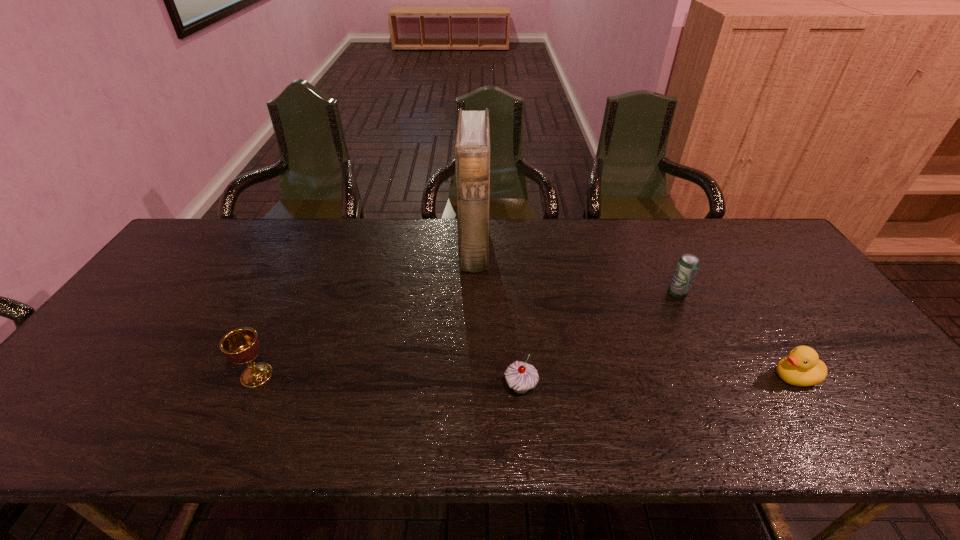
The image size is (960, 540). I want to click on vacant area that lies between the beer can and the shortest object, so click(735, 336).

The height and width of the screenshot is (540, 960). In order to click on vacant space that's between the third object from right to left and the second object from left to right in this screenshot , I will do `click(497, 317)`.

I want to click on empty location between the beer can and the duckling, so click(735, 336).

Where is `free space between the chalice and the beer can`? Image resolution: width=960 pixels, height=540 pixels. free space between the chalice and the beer can is located at coordinates (467, 335).

This screenshot has width=960, height=540. What are the coordinates of `empty space that is in between the chalice and the farthest object` in the screenshot? It's located at (366, 311).

At what (x,y) coordinates should I click in order to perform the action: click on free area in between the third object from right to left and the beer can. Please return your answer as a coordinate pair (x, y). The height and width of the screenshot is (540, 960). Looking at the image, I should click on (x=598, y=341).

The width and height of the screenshot is (960, 540). I want to click on free area in between the second farthest object and the shortest object, so click(735, 336).

Locate an element on the screen. The image size is (960, 540). free space between the cupcake and the second farthest object is located at coordinates (598, 341).

Locate an element on the screen. The height and width of the screenshot is (540, 960). free space between the leftmost object and the fourth nearest object is located at coordinates [x=467, y=335].

Locate an element on the screen. This screenshot has height=540, width=960. free space between the shortest object and the tallest object is located at coordinates (635, 312).